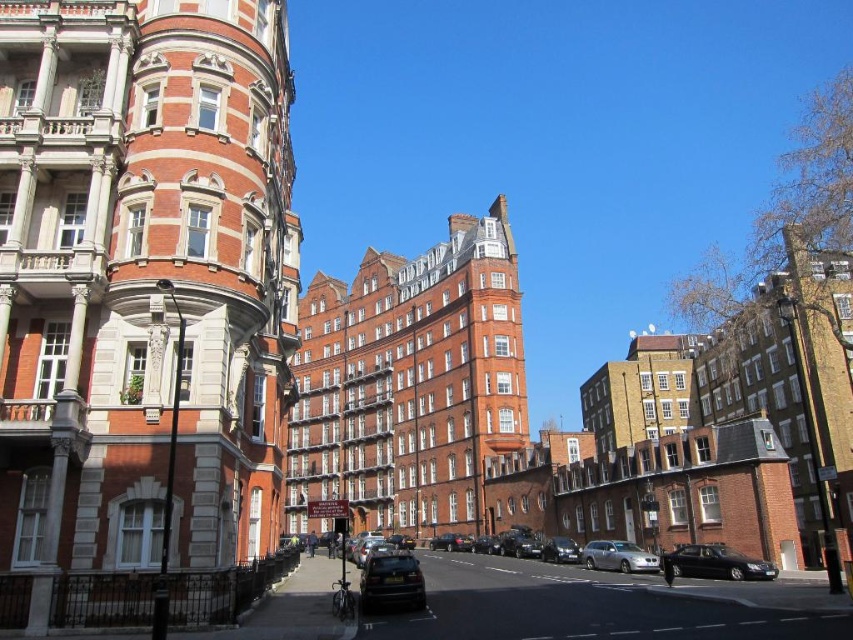
You are a delivery person who needs to park your 5 meter long truck between the shiny black sedan at lower right and the shiny silver car at center. Is there enough space between them to park your truck?

The distance between the shiny black sedan at lower right and the shiny silver car at center is 16.01 meters. Since your truck is only 5 meters long, there is more than enough space to park it between them.

Based on the photo, you are a pedestrian standing at the crosswalk near the historic buildings. You need to cross the street but want to avoid the parked cars. Which car, the shiny black car at lower center or the shiny black sedan at lower right, is closer to the crosswalk?

The shiny black car at lower center is closer to the crosswalk because it is positioned to the left of the shiny black sedan at lower right, which is further away from the crosswalk.

You are standing at the location of the viewer in this historic street scene. There is a shiny black sedan at lower right. If you want to walk to the sedan, how many steps would you need to take if each step is about 3 feet long?

The shiny black sedan at lower right is 161.88 feet away from the viewer. Dividing the distance by the step length of 3 feet gives approximately 53.96 steps. Since you can only take whole steps, you would need to take about 54 steps to reach the shiny black sedan at lower right.